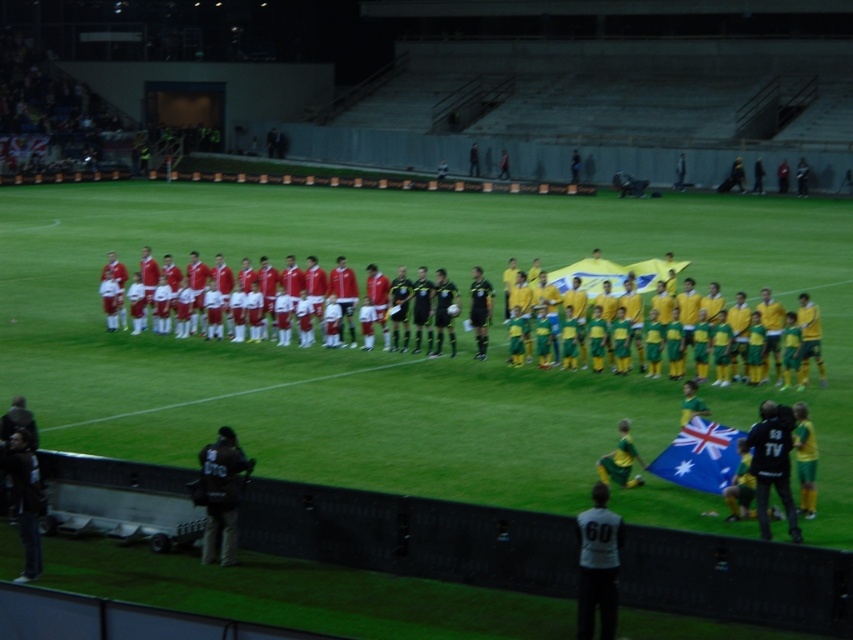
Question: Among these objects, which one is nearest to the camera?

Choices:
 (A) matte red uniform at center
 (B) blue fabric flag at lower right

Answer: (B)

Question: Can you confirm if blue fabric flag at lower right is positioned to the right of matte red uniform at center?

Choices:
 (A) no
 (B) yes

Answer: (B)

Question: Does blue fabric flag at lower right appear on the left side of matte red uniform at center?

Choices:
 (A) no
 (B) yes

Answer: (A)

Question: Is blue fabric flag at lower right to the left of matte red uniform at center from the viewer's perspective?

Choices:
 (A) yes
 (B) no

Answer: (B)